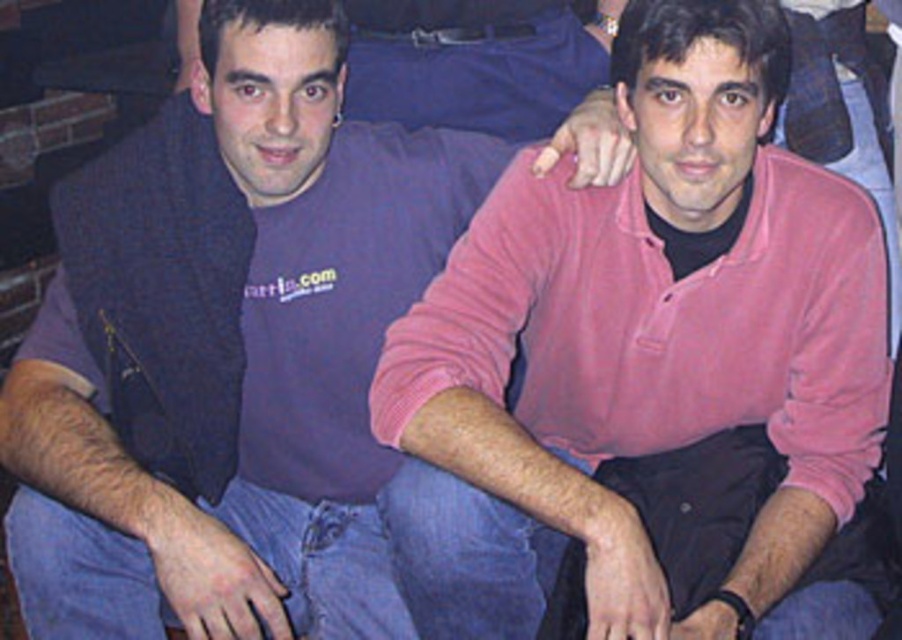
You are a fashion designer observing two sweaters in the image. The pink cotton sweater at center and the purple soft sweater at center. Which one is positioned lower in the image?

The pink cotton sweater at center is below the purple soft sweater at center, so the pink cotton sweater at center is positioned lower in the image.

You are standing in a room where two people are sitting close together. You notice a pink cotton sweater at center and a purple soft sweater at center. Which sweater is nearer to you?

The pink cotton sweater at center is closer to the viewer than the purple soft sweater at center.